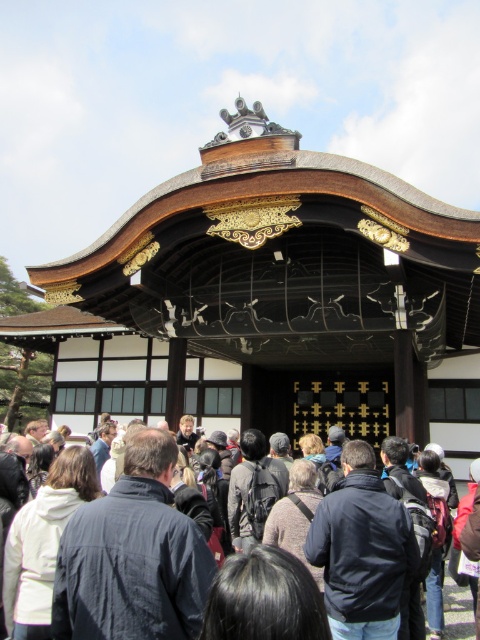
Question: Is knitted sweater at center to the left of dark blue fabric backpack at center from the viewer's perspective?

Choices:
 (A) no
 (B) yes

Answer: (B)

Question: Which point appears closest to the camera in this image?

Choices:
 (A) (307, 460)
 (B) (59, 461)

Answer: (B)

Question: Which point appears farthest from the camera in this image?

Choices:
 (A) (472, 536)
 (B) (280, 525)

Answer: (A)

Question: Observing the image, what is the correct spatial positioning of black hair at center in reference to dark gray backpack at center?

Choices:
 (A) above
 (B) below

Answer: (B)

Question: Which point appears closest to the camera in this image?

Choices:
 (A) 188,596
 (B) 242,604

Answer: (B)

Question: From the image, what is the correct spatial relationship of white fleece jacket at lower left in relation to black hair at center?

Choices:
 (A) below
 (B) above

Answer: (A)